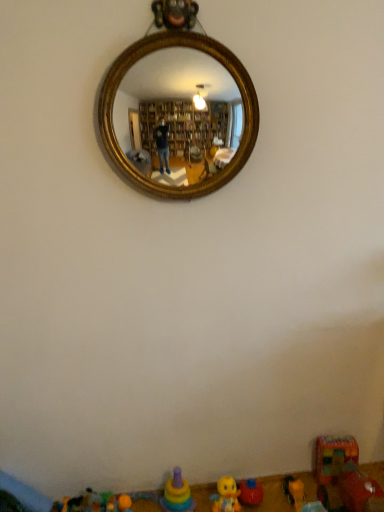
Question: Is the depth of yellow rubber duck at lower center, which is the fourth toy in right-to-left order, less than that of yellow plastic toy at lower right, which is the 6th toy from left to right?

Choices:
 (A) yes
 (B) no

Answer: (A)

Question: From the image's perspective, is yellow rubber duck at lower center, the 4th toy viewed from the left, below yellow plastic toy at lower right, which is the 6th toy from left to right?

Choices:
 (A) yes
 (B) no

Answer: (B)

Question: Does yellow rubber duck at lower center, the 4th toy viewed from the left, lie behind yellow plastic toy at lower right, which is counted as the second toy, starting from the right?

Choices:
 (A) no
 (B) yes

Answer: (A)

Question: From the image's perspective, is yellow rubber duck at lower center, which is the fourth toy in right-to-left order, over yellow plastic toy at lower right, which is counted as the second toy, starting from the right?

Choices:
 (A) yes
 (B) no

Answer: (A)

Question: Does yellow rubber duck at lower center, which is the fourth toy in right-to-left order, touch yellow plastic toy at lower right, which is the 6th toy from left to right?

Choices:
 (A) yes
 (B) no

Answer: (B)

Question: Can you confirm if yellow rubber duck at lower center, which is the fourth toy in right-to-left order, is thinner than yellow plastic toy at lower right, which is the 6th toy from left to right?

Choices:
 (A) no
 (B) yes

Answer: (B)

Question: Considering the relative sizes of multicolored plastic stacking rings at lower center, acting as the 5th toy starting from the right, and orange rubber ball at lower center, the 2th toy in the left-to-right sequence, in the image provided, is multicolored plastic stacking rings at lower center, acting as the 5th toy starting from the right, shorter than orange rubber ball at lower center, the 2th toy in the left-to-right sequence,?

Choices:
 (A) yes
 (B) no

Answer: (B)

Question: Can you confirm if multicolored plastic stacking rings at lower center, acting as the 3th toy starting from the left, is wider than orange rubber ball at lower center, the 2th toy in the left-to-right sequence?

Choices:
 (A) yes
 (B) no

Answer: (A)

Question: From the image's perspective, would you say multicolored plastic stacking rings at lower center, acting as the 3th toy starting from the left, is shown under orange rubber ball at lower center, the 6th toy in the right-to-left sequence?

Choices:
 (A) yes
 (B) no

Answer: (B)

Question: Considering the relative sizes of multicolored plastic stacking rings at lower center, acting as the 5th toy starting from the right, and orange rubber ball at lower center, the 2th toy in the left-to-right sequence, in the image provided, is multicolored plastic stacking rings at lower center, acting as the 5th toy starting from the right, thinner than orange rubber ball at lower center, the 2th toy in the left-to-right sequence,?

Choices:
 (A) yes
 (B) no

Answer: (B)

Question: Is multicolored plastic stacking rings at lower center, acting as the 5th toy starting from the right, behind orange rubber ball at lower center, the 2th toy in the left-to-right sequence?

Choices:
 (A) yes
 (B) no

Answer: (B)

Question: Is plastic multicolored car at lower right, which is the first toy from right to left, far from yellow plastic toy at lower right, which is the 6th toy from left to right?

Choices:
 (A) yes
 (B) no

Answer: (B)